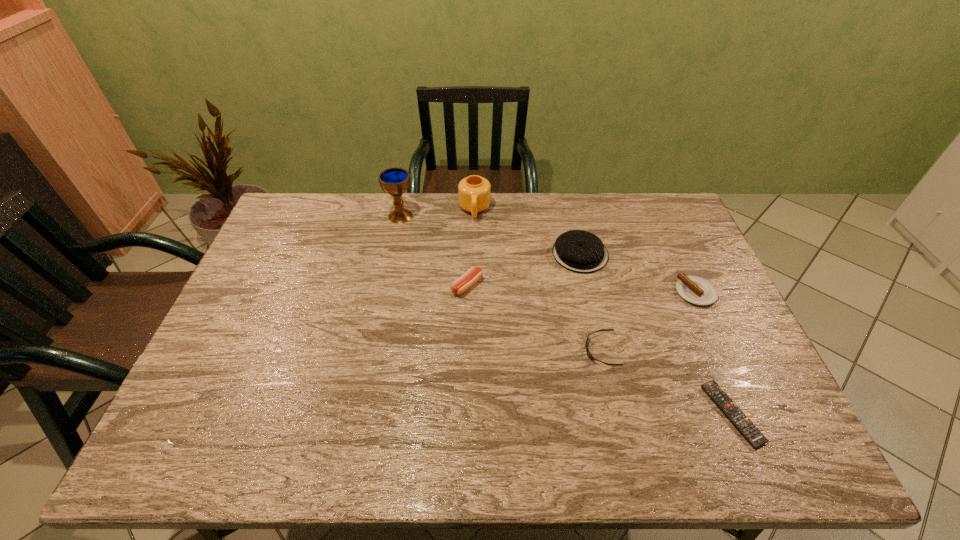
This screenshot has height=540, width=960. What are the coordinates of `vacant space located 0.250m on the back of the nearest object` in the screenshot? It's located at (686, 306).

This screenshot has height=540, width=960. Find the location of `chalice present at the far edge`. chalice present at the far edge is located at coordinates (395, 181).

Where is `mug that is positioned at the far edge`? mug that is positioned at the far edge is located at coordinates (474, 191).

Identify the location of object that is positioned at the near edge. click(x=734, y=414).

Find the location of `sausage that is at the right edge`. sausage that is at the right edge is located at coordinates (694, 289).

Where is `remote control present at the right edge`? This screenshot has height=540, width=960. remote control present at the right edge is located at coordinates (734, 414).

In order to click on object that is at the near right corner in this screenshot , I will do `click(734, 414)`.

Locate an element on the screen. The width and height of the screenshot is (960, 540). free spot at the far edge of the desktop is located at coordinates pyautogui.click(x=499, y=225).

Find the location of a particular element. This screenshot has height=540, width=960. blank space at the near edge of the desktop is located at coordinates (439, 456).

In the image, there is a desktop. Where is `vacant space at the left edge`? vacant space at the left edge is located at coordinates (238, 297).